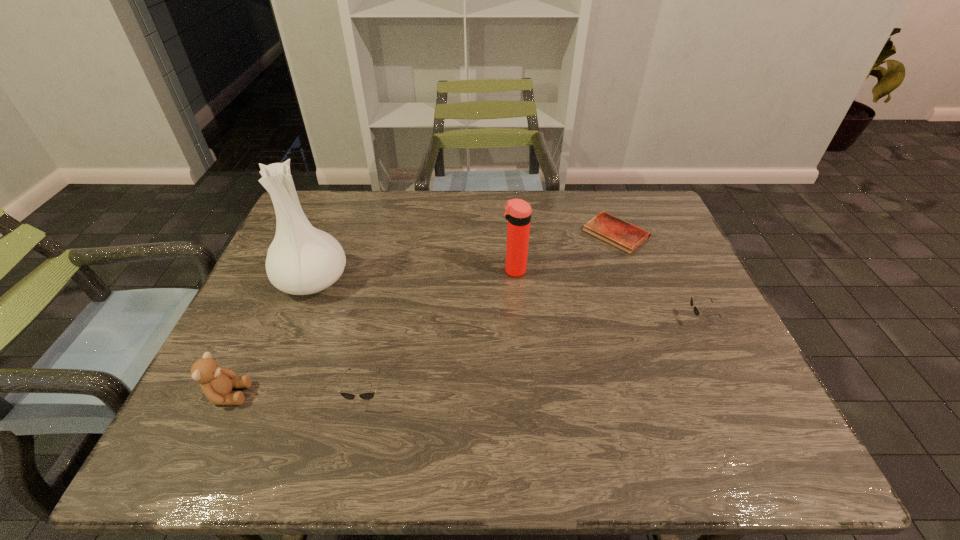
In order to click on vase that is at the left edge in this screenshot , I will do `click(301, 260)`.

Find the location of a particular element. teddy bear situated at the left edge is located at coordinates (217, 383).

Locate an element on the screen. The height and width of the screenshot is (540, 960). sunglasses at the right edge is located at coordinates (696, 311).

Where is `diary positioned at the right edge`? The height and width of the screenshot is (540, 960). diary positioned at the right edge is located at coordinates (x=619, y=233).

Where is `object positioned at the near left corner`? Image resolution: width=960 pixels, height=540 pixels. object positioned at the near left corner is located at coordinates (217, 383).

I want to click on object located at the far right corner, so click(x=619, y=233).

Where is `vacant space at the far edge`? vacant space at the far edge is located at coordinates (378, 208).

Find the location of a particular element. free space at the right edge is located at coordinates (679, 271).

The width and height of the screenshot is (960, 540). What are the coordinates of `free space at the far left corner` in the screenshot? It's located at (311, 217).

Where is `vacant space at the far right corner of the desktop`? This screenshot has width=960, height=540. vacant space at the far right corner of the desktop is located at coordinates (652, 228).